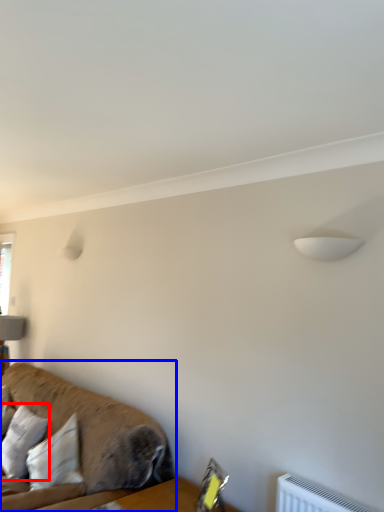
Question: Among these objects, which one is farthest to the camera, pillow (highlighted by a red box) or studio couch (highlighted by a blue box)?

Choices:
 (A) pillow
 (B) studio couch

Answer: (A)